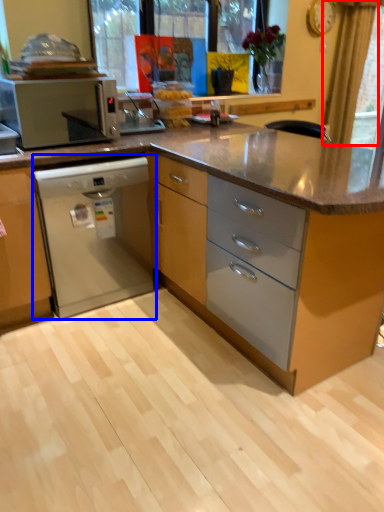
Question: Which object is further to the camera taking this photo, curtain (highlighted by a red box) or home appliance (highlighted by a blue box)?

Choices:
 (A) curtain
 (B) home appliance

Answer: (A)